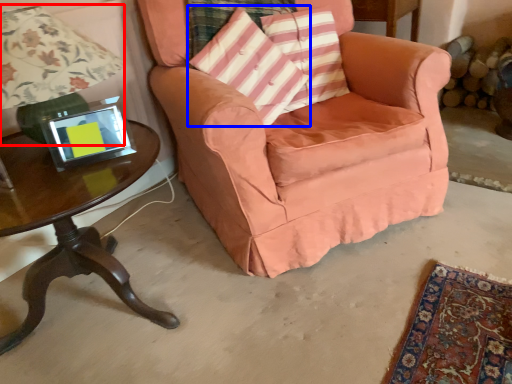
Question: Among these objects, which one is farthest to the camera, lamp (highlighted by a red box) or throw pillow (highlighted by a blue box)?

Choices:
 (A) lamp
 (B) throw pillow

Answer: (B)